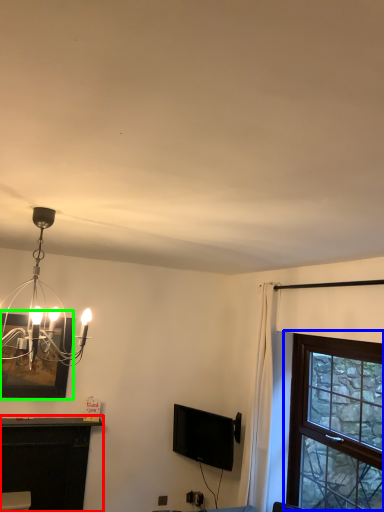
Question: Which is nearer to the table (highlighted by a red box)? window (highlighted by a blue box) or picture frame (highlighted by a green box).

Choices:
 (A) window
 (B) picture frame

Answer: (B)